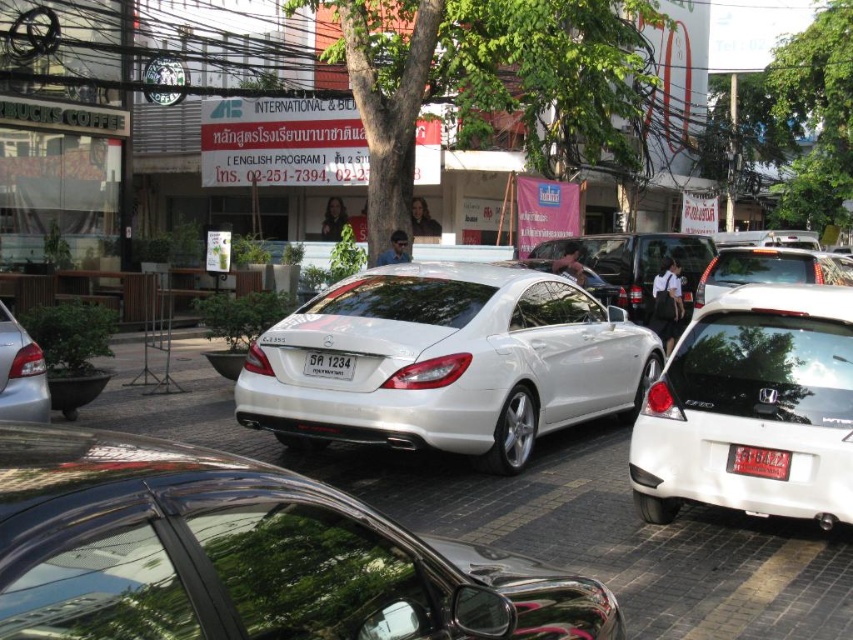
You are a pedestrian standing on the sidewalk observing the scene. You see the glossy metallic car at center and the metallic silver sedan at lower left. Which car is closer to you?

The glossy metallic car at center is closer to you because it is in front of the metallic silver sedan at lower left.

You are a delivery driver who needs to park your van next to the glossy metallic car at center and the sleek silver sedan at center. Which vehicle should you park closer to if you want to maximize the available space for your van?

You should park closer to the glossy metallic car at center because it occupies less space than the sleek silver sedan at center, allowing more room for your van.